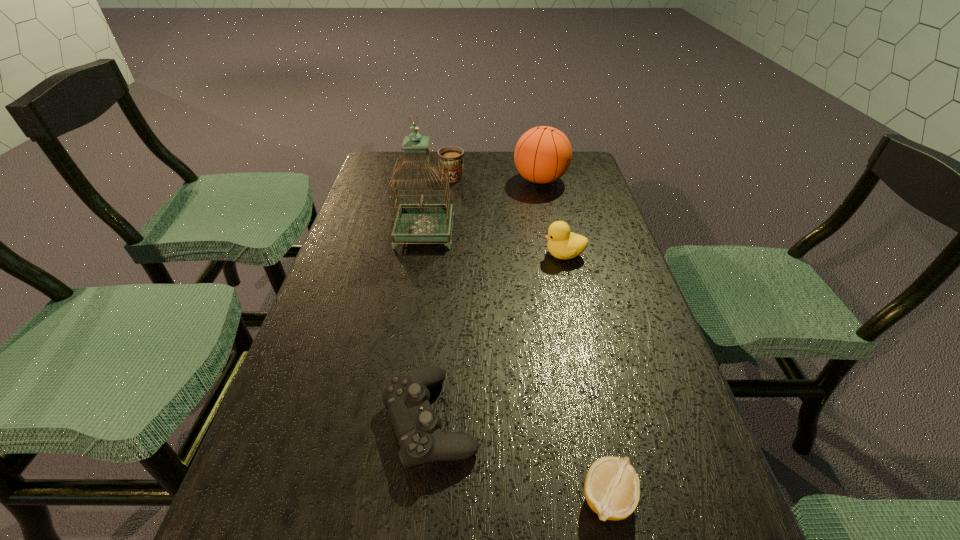
What are the coordinates of `object present at the far right corner` in the screenshot? It's located at (543, 154).

What are the coordinates of `vacant space at the far edge of the desktop` in the screenshot? It's located at (478, 163).

Where is `vacant point at the left edge`? vacant point at the left edge is located at coordinates (288, 370).

Locate an element on the screen. The height and width of the screenshot is (540, 960). blank area at the right edge is located at coordinates (664, 353).

Where is `vacant space at the far right corner of the desktop`? vacant space at the far right corner of the desktop is located at coordinates (574, 167).

You are a GUI agent. You are given a task and a screenshot of the screen. Output one action in this format:
    pyautogui.click(x=<x>, y=<y>)
    Task: Click on the free spot between the fifth tallest object and the birdcage
    Image resolution: width=960 pixels, height=540 pixels.
    Given the screenshot: What is the action you would take?
    pyautogui.click(x=427, y=326)

Where is `empty space that is in between the lemon and the second shortest object`? Image resolution: width=960 pixels, height=540 pixels. empty space that is in between the lemon and the second shortest object is located at coordinates (518, 460).

The width and height of the screenshot is (960, 540). Find the location of `empty location between the tallest object and the second tallest object`. empty location between the tallest object and the second tallest object is located at coordinates (483, 206).

Locate an element on the screen. free space between the duck and the shortest object is located at coordinates (587, 377).

Locate an element on the screen. The image size is (960, 540). vacant area that lies between the duck and the shortest object is located at coordinates (587, 377).